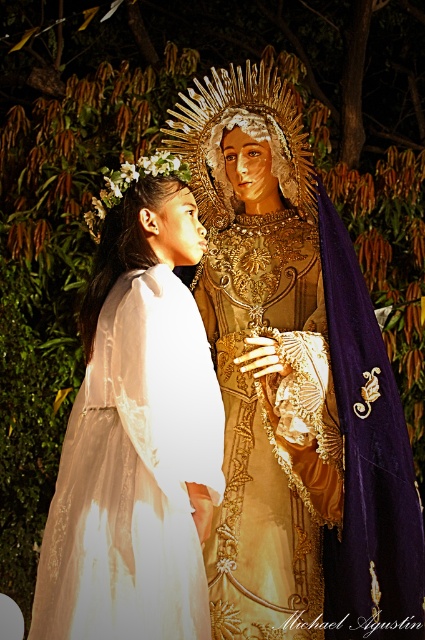
You are a photographer taking a nighttime photo of the scene described. You need to ensure that both the white lace dress at left and the gold textured crown at center are clearly visible. Given their sizes, which object might require more lighting adjustment to highlight its details?

The gold textured crown at center requires more lighting adjustment because the white lace dress at left is taller, so it may naturally catch more light, whereas the smaller crown might need additional focus to ensure its details are visible.

You are an artist trying to sketch the scene. You need to place the white lace dress at left and the gold textured crown at center correctly. Based on the description, which object is positioned to the left of the other?

The white lace dress at left is positioned to the left of the gold textured crown at center.

Looking at this image, you are a photographer standing at the edge of the scene. You want to capture a closeup shot of both the gold satin dress at center and the gold textured crown at center in the same frame. Given that your camera has a minimum focusing distance of 6 meters, will you be able to achieve this?

The gold satin dress at center is 6.35 meters away from the gold textured crown at center. Since the minimum focusing distance is 6 meters, the photographer will be able to capture both in the same frame as they are within the required distance.